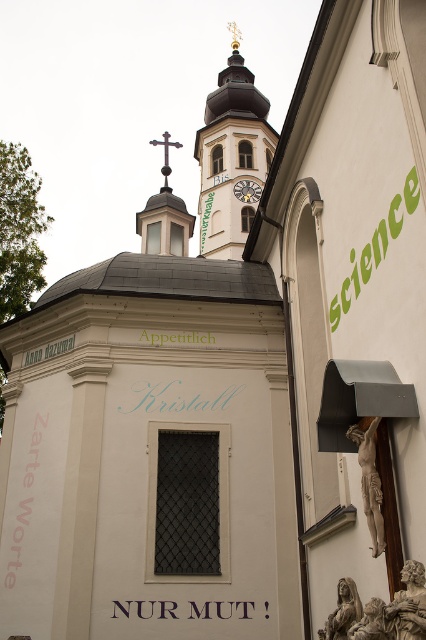
You are an artist standing at point [23,500] in the church scene. You have a pink paper at lower left. Which direction should you move to place it closer to the dome with the cross?

The pink paper at lower left is already at point [23,500], so moving towards the dome with the cross would require moving to the right since the dome is on the left side of the scene.

You are standing in front of the church building and want to determine which of the two points, point (13, 563) or point (330, 627), is closer to you. Based on the scene description, which point is nearer?

Point (13, 563) is further to the viewer than point (330, 627). Wait, no, the description says the opposite. Let me check again. The Objects Description states that point (13, 563) is further to the viewer than point (330, 627). Wait, the user says the description says point A is further than point B, so point A is closer? Hmm, maybe I need to clarify. If point A is further to the viewer than point B, that means point A is closer to the viewer. Because being further to the viewer implies it is in,